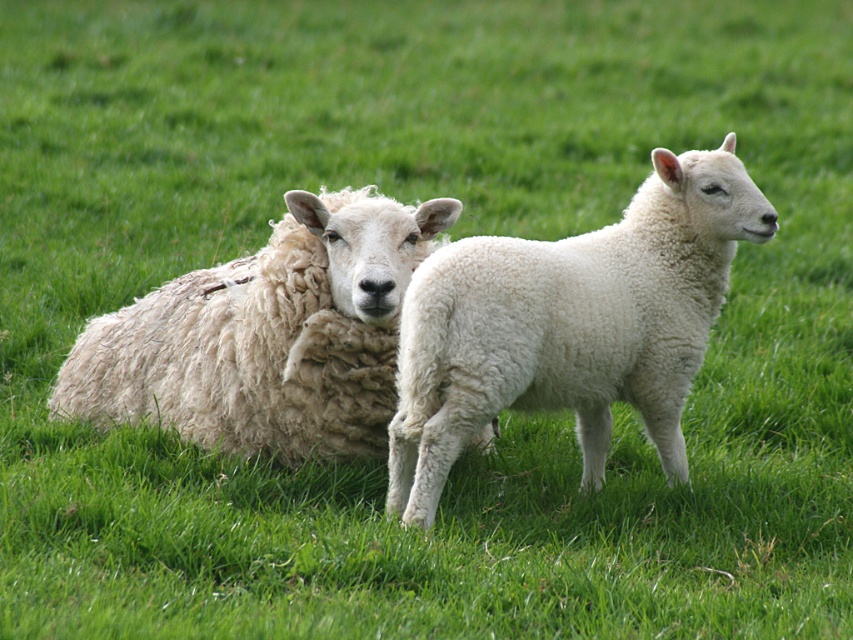
Question: Does white fluffy lamb at center have a smaller size compared to white woolen sheep at center?

Choices:
 (A) yes
 (B) no

Answer: (A)

Question: Is white fluffy lamb at center positioned at the back of white woolen sheep at center?

Choices:
 (A) yes
 (B) no

Answer: (B)

Question: Which point is closer to the camera taking this photo?

Choices:
 (A) (125, 321)
 (B) (717, 269)

Answer: (B)

Question: Which of the following is the closest to the observer?

Choices:
 (A) (459, 280)
 (B) (71, 369)

Answer: (A)

Question: Can you confirm if white fluffy lamb at center is positioned to the right of white woolen sheep at center?

Choices:
 (A) yes
 (B) no

Answer: (A)

Question: Which point appears farthest from the camera in this image?

Choices:
 (A) (590, 291)
 (B) (320, 333)

Answer: (B)